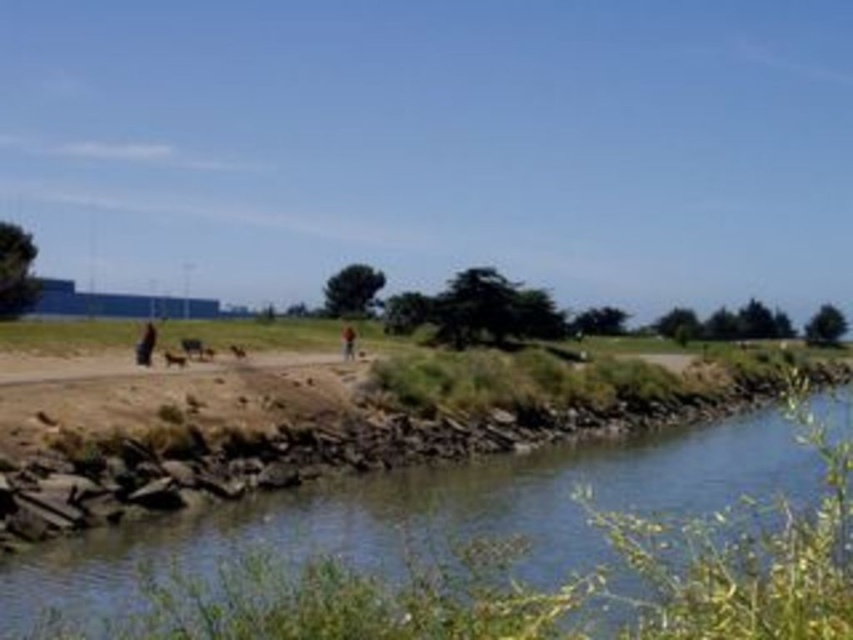
Question: Observing the image, what is the correct spatial positioning of clear water at lower left in reference to dark blue jeans at center?

Choices:
 (A) left
 (B) right

Answer: (B)

Question: Which point is farther to the camera?

Choices:
 (A) clear water at lower left
 (B) dark blue jeans at center

Answer: (B)

Question: Does clear water at lower left have a lesser width compared to dark blue jeans at center?

Choices:
 (A) yes
 (B) no

Answer: (B)

Question: Is clear water at lower left closer to the viewer compared to dark blue jeans at center?

Choices:
 (A) yes
 (B) no

Answer: (A)

Question: Which object is closer to the camera taking this photo?

Choices:
 (A) dark blue jeans at center
 (B) clear water at lower left

Answer: (B)